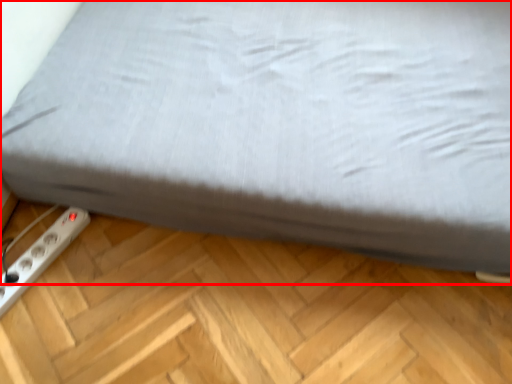
Question: From the image's perspective, considering the relative positions of bed (annotated by the red box) and power plugs and sockets in the image provided, where is bed (annotated by the red box) located with respect to the staircase?

Choices:
 (A) above
 (B) below

Answer: (A)